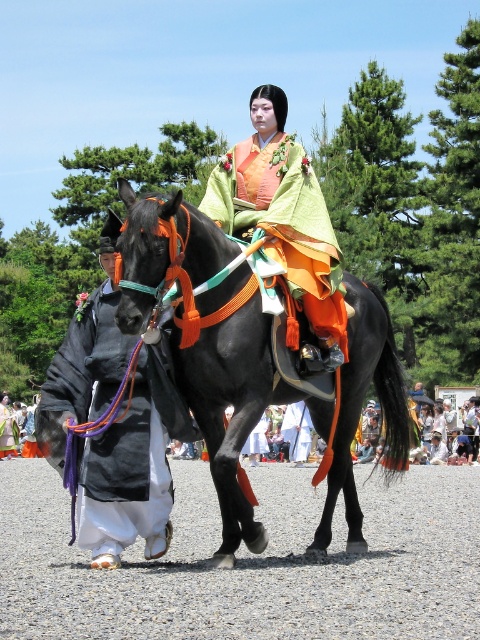
You are a photographer positioned at the origin point. The shiny black horse at center is at coordinates 0.566, 0.525. If you want to capture both the rider in the vibrant orange kimono and the person walking beside them in the dark robe, where should you adjust your camera focus?

The shiny black horse at center is located at point (252,362), so you should adjust your camera focus to that central area to capture both the rider and the person walking beside them.

You are standing at the starting point and need to reach the end point. The scene shows a horse with two riders in a ceremonial event. There are two points marked in the image. The first point is at coordinate point[446,524] and the second point is at coordinate point[319,296]. Which point should you head towards first to follow the path taken by the riders?

You should head towards point[319,296] first because point[446,524] is behind it, indicating that the riders passed through point[319,296] before reaching the other point.